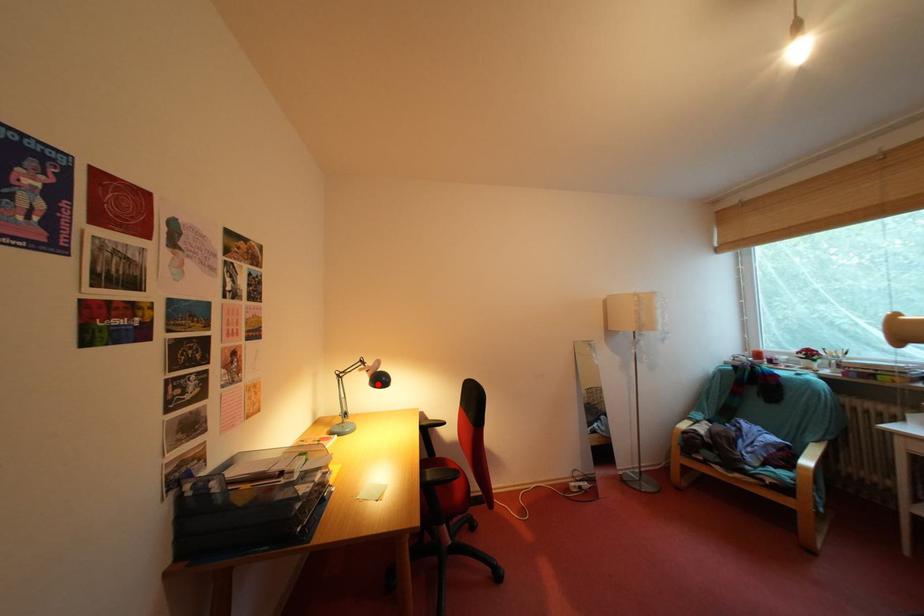
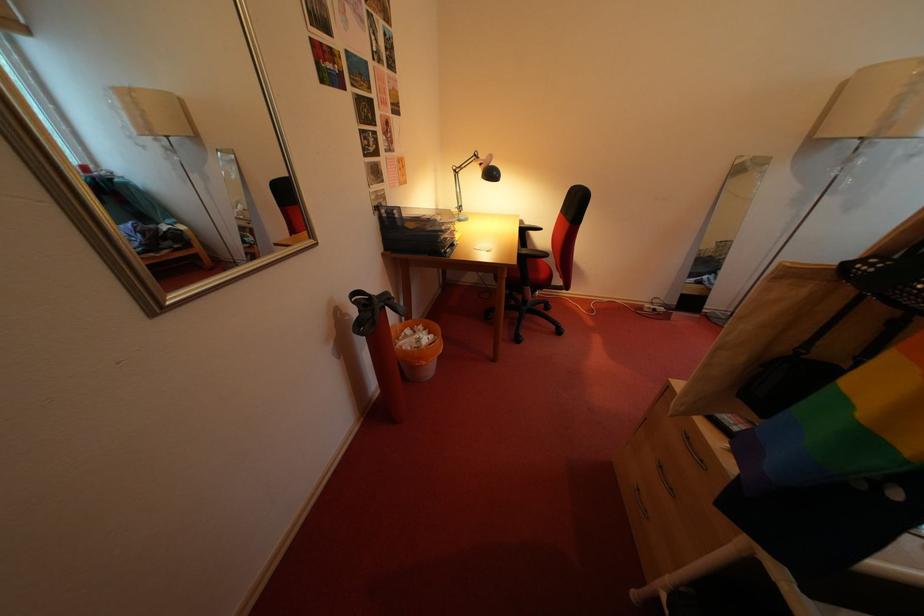
Where in the second image is the point corresponding to the highlighted location from the first image?

(491, 177)